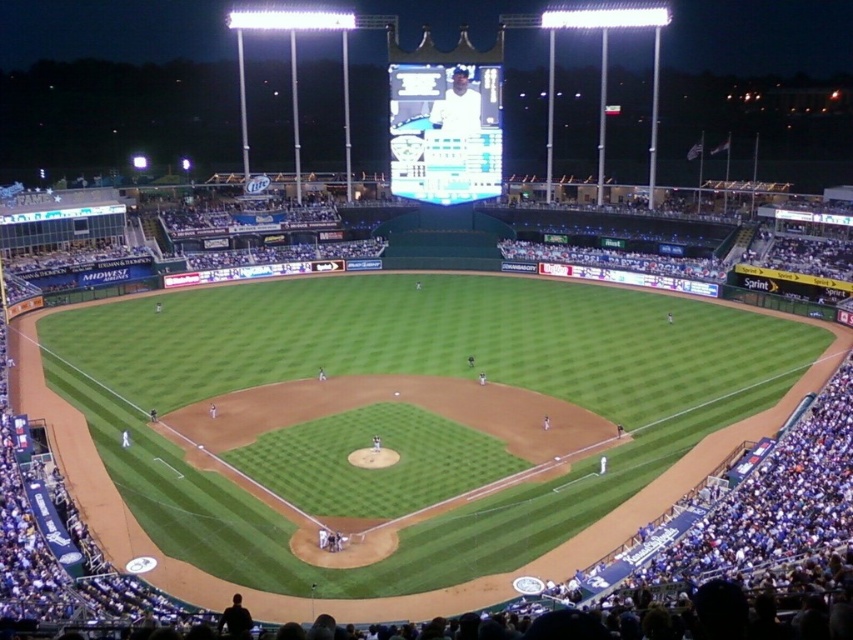
Is white glossy scoreboard at upper center positioned in front of white matte uniform at upper center?

Yes, it is.

Does white glossy scoreboard at upper center have a lesser height compared to white matte uniform at upper center?

No, white glossy scoreboard at upper center is not shorter than white matte uniform at upper center.

Measure the distance between white glossy scoreboard at upper center and camera.

white glossy scoreboard at upper center and camera are 116.43 meters apart from each other.

The image size is (853, 640). What are the coordinates of `white glossy scoreboard at upper center` in the screenshot? It's located at (445, 120).